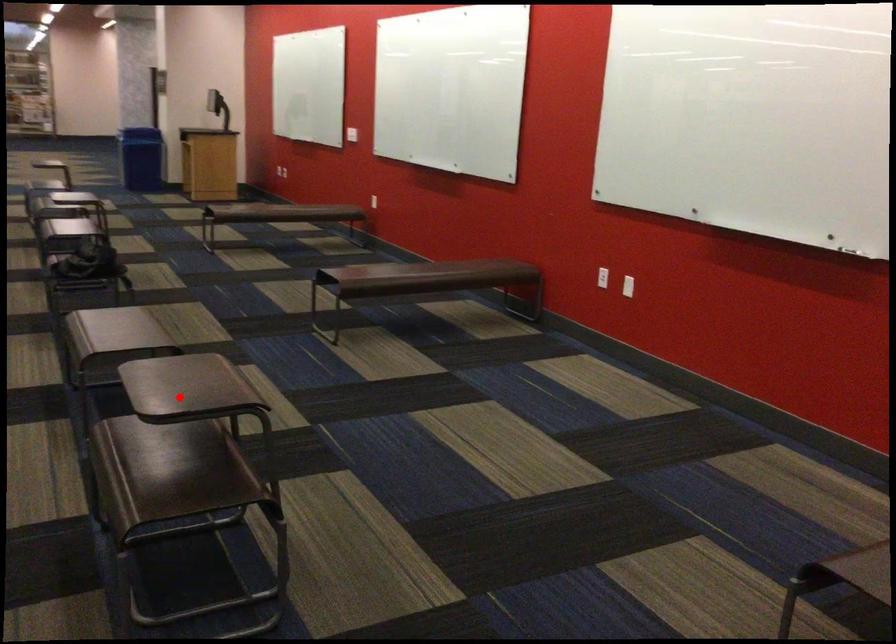
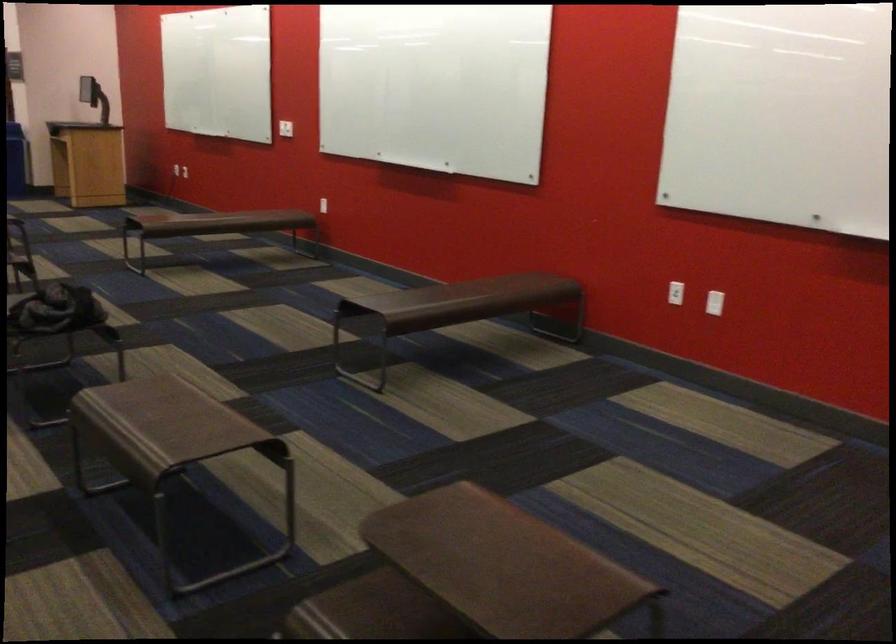
Question: A red point is marked in image1. In image2, is the corresponding 3D point closer to the camera or farther? Reply with the corresponding letter.

Choices:
 (A) The corresponding 3D point is closer.
 (B) The corresponding 3D point is farther.

Answer: (A)